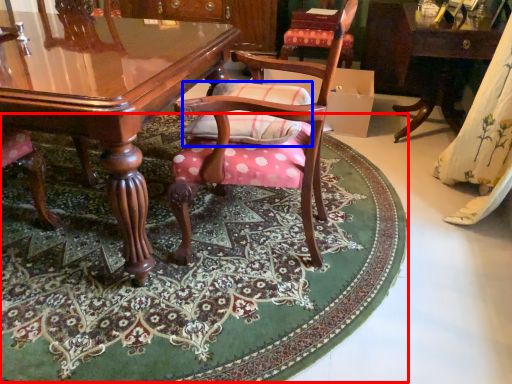
Question: Among these objects, which one is farthest to the camera, mat (highlighted by a red box) or pillow (highlighted by a blue box)?

Choices:
 (A) mat
 (B) pillow

Answer: (B)